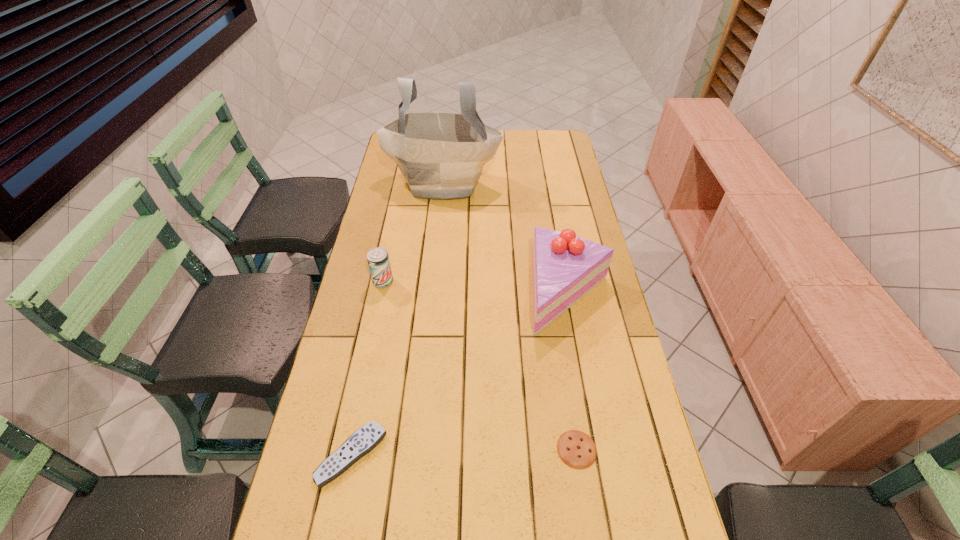
Where is `object that is the second closest to the cookie`? This screenshot has width=960, height=540. object that is the second closest to the cookie is located at coordinates (366, 438).

The image size is (960, 540). In order to click on vacant region that satisfies the following two spatial constraints: 1. on the front side of the remote control; 2. on the right side of the beer can in this screenshot , I will do `click(347, 455)`.

You are a GUI agent. You are given a task and a screenshot of the screen. Output one action in this format:
    pyautogui.click(x=<x>, y=<y>)
    Task: Click on the vacant space that satisfies the following two spatial constraints: 1. on the front side of the shopping bag; 2. on the right side of the cake
    This screenshot has width=960, height=540.
    Given the screenshot: What is the action you would take?
    click(x=432, y=293)

This screenshot has width=960, height=540. I want to click on free space that satisfies the following two spatial constraints: 1. on the front side of the second tallest object; 2. on the right side of the farthest object, so click(432, 293).

Locate an element on the screen. The image size is (960, 540). vacant area in the image that satisfies the following two spatial constraints: 1. on the front side of the cake; 2. on the right side of the beer can is located at coordinates (381, 293).